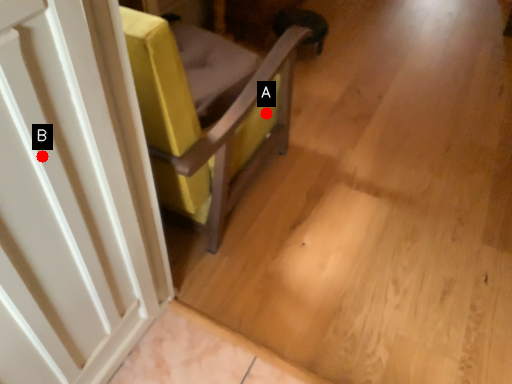
Question: Two points are circled on the image, labeled by A and B beside each circle. Which point appears closest to the camera in this image?

Choices:
 (A) A is closer
 (B) B is closer

Answer: (B)